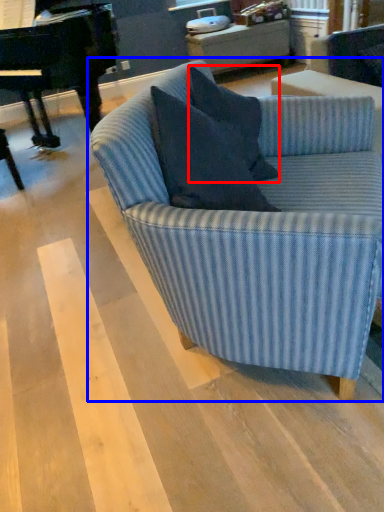
Question: Which object appears farthest to the camera in this image, pillow (highlighted by a red box) or studio couch (highlighted by a blue box)?

Choices:
 (A) pillow
 (B) studio couch

Answer: (A)